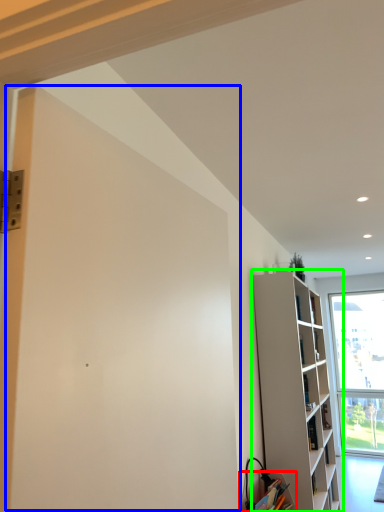
Question: Which object is the farthest from cabinetry (highlighted by a red box)? Choose among these: screen door (highlighted by a blue box) or shelf (highlighted by a green box).

Choices:
 (A) screen door
 (B) shelf

Answer: (A)